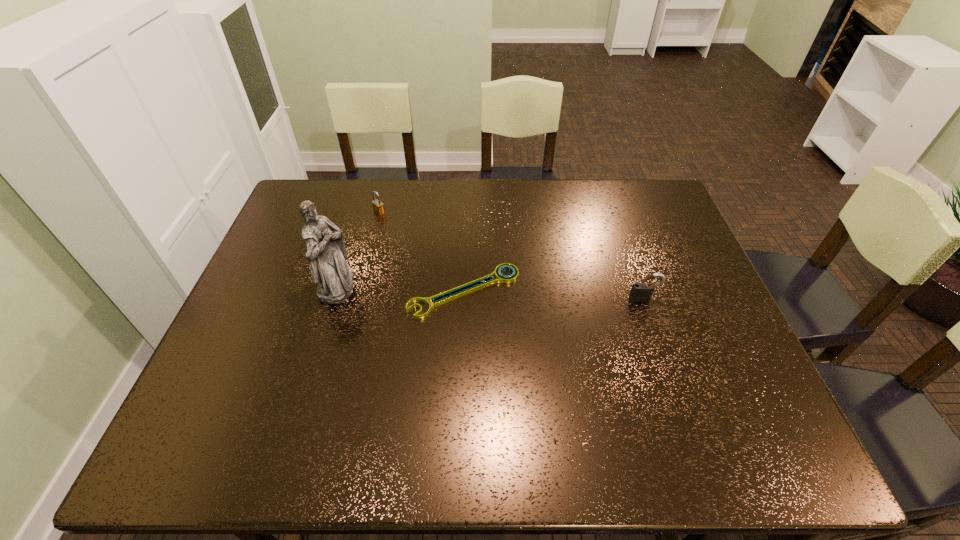
Where is `free space between the farthest object and the wrench`? This screenshot has width=960, height=540. free space between the farthest object and the wrench is located at coordinates (422, 252).

Identify the location of blank region between the tallest object and the second object from right to left. (400, 288).

The height and width of the screenshot is (540, 960). I want to click on unoccupied area between the shortest object and the right padlock, so click(554, 295).

Where is `free space that is in between the figurine and the wrench`? free space that is in between the figurine and the wrench is located at coordinates 400,288.

Where is `empty space between the figurine and the wrench`? The width and height of the screenshot is (960, 540). empty space between the figurine and the wrench is located at coordinates (400, 288).

This screenshot has height=540, width=960. Identify the location of blank region between the figurine and the rightmost object. (491, 292).

At what (x,y) coordinates should I click in order to perform the action: click on vacant space that is in between the shorter padlock and the right padlock. Please return your answer as a coordinate pair (x, y). Looking at the image, I should click on [512, 255].

Find the location of a particular element. This screenshot has width=960, height=540. free space between the figurine and the shorter padlock is located at coordinates (358, 248).

Identify which object is the nearest to the second object from right to left. Please provide its 2D coordinates. Your answer should be formatted as a tuple, i.e. [(x, y)], where the tuple contains the x and y coordinates of a point satisfying the conditions above.

[(326, 253)]

In order to click on the second closest object to the tallest object in this screenshot , I will do `click(378, 207)`.